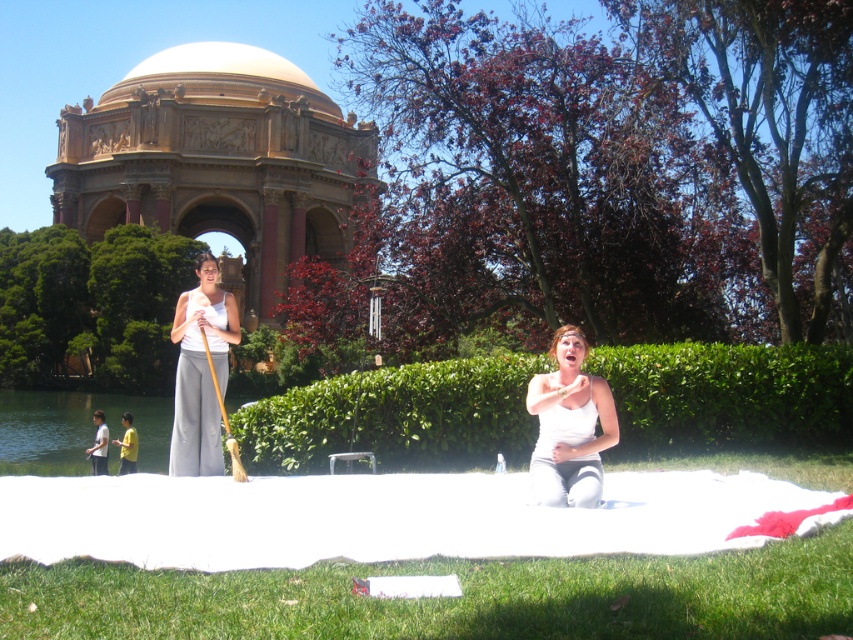
Question: Can you confirm if green grass at lower center is positioned above light blue shirt at lower left?

Choices:
 (A) no
 (B) yes

Answer: (A)

Question: Which object appears farthest from the camera in this image?

Choices:
 (A) white matte tank top at lower center
 (B) white cotton tank top at center
 (C) light blue shirt at lower left
 (D) green grass at lower center

Answer: (C)

Question: Which point is closer to the camera taking this photo?

Choices:
 (A) (96, 442)
 (B) (611, 435)
 (C) (132, 452)
 (D) (701, 531)

Answer: (D)

Question: Among these points, which one is nearest to the camera?

Choices:
 (A) (125, 461)
 (B) (538, 484)
 (C) (202, 276)
 (D) (99, 426)

Answer: (B)

Question: Considering the relative positions of white fabric blanket at lower center and light blue shirt at lower left in the image provided, where is white fabric blanket at lower center located with respect to light blue shirt at lower left?

Choices:
 (A) right
 (B) left

Answer: (A)

Question: Observing the image, what is the correct spatial positioning of green grass at lower center in reference to white cotton tank top at center?

Choices:
 (A) above
 (B) below

Answer: (B)